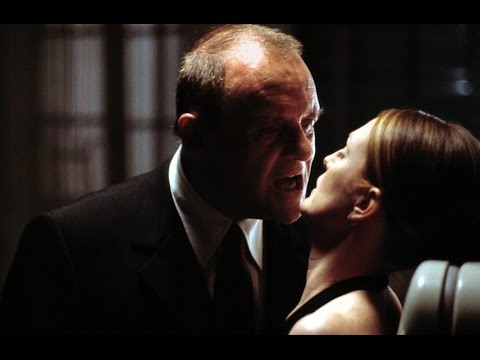
I want to click on back wall, so click(16, 166), click(334, 125).